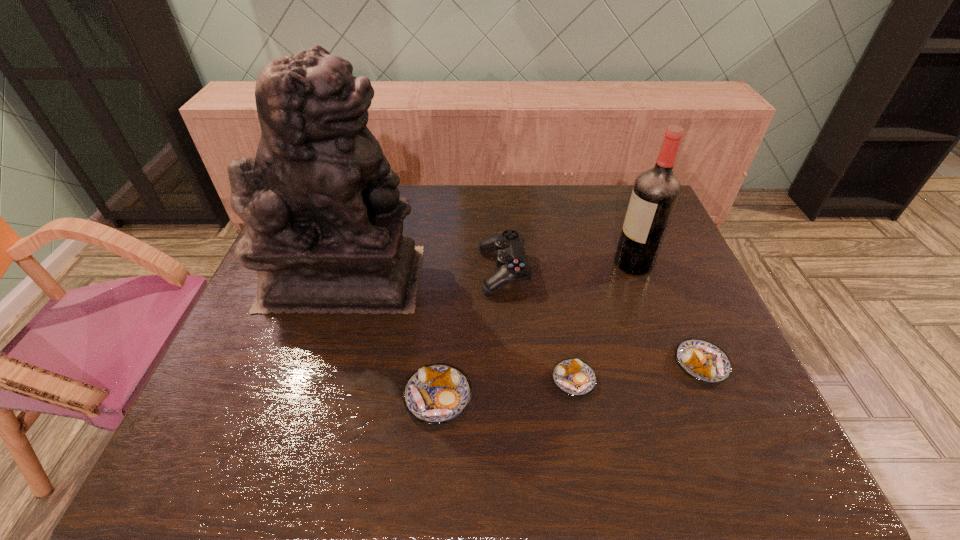
Observe the arrangement of all pastrys in the image. To keep them evenly spaced, where would you place another pastry on the left? Please locate a free space. Please provide its 2D coordinates. Your answer should be formatted as a tuple, i.e. [(x, y)], where the tuple contains the x and y coordinates of a point satisfying the conditions above.

[(293, 415)]